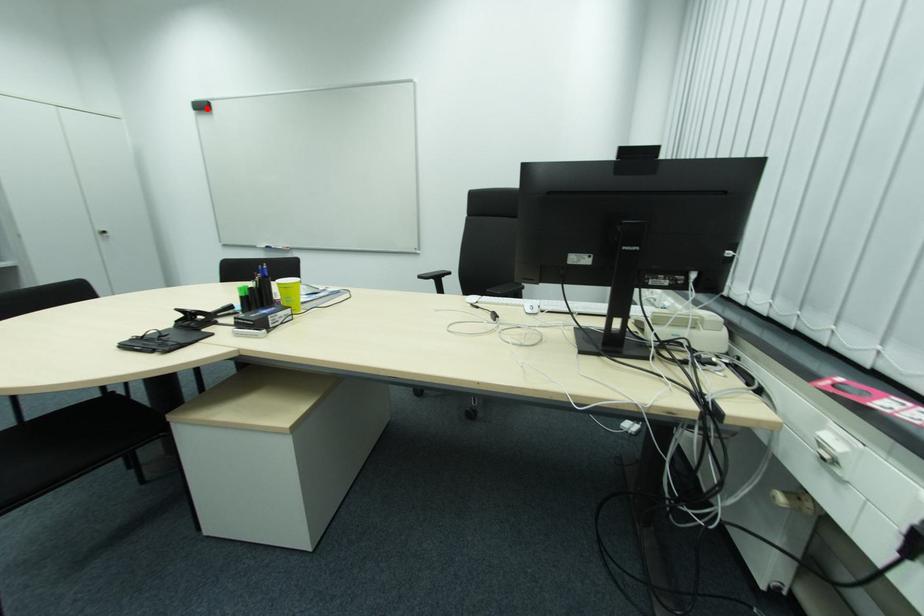
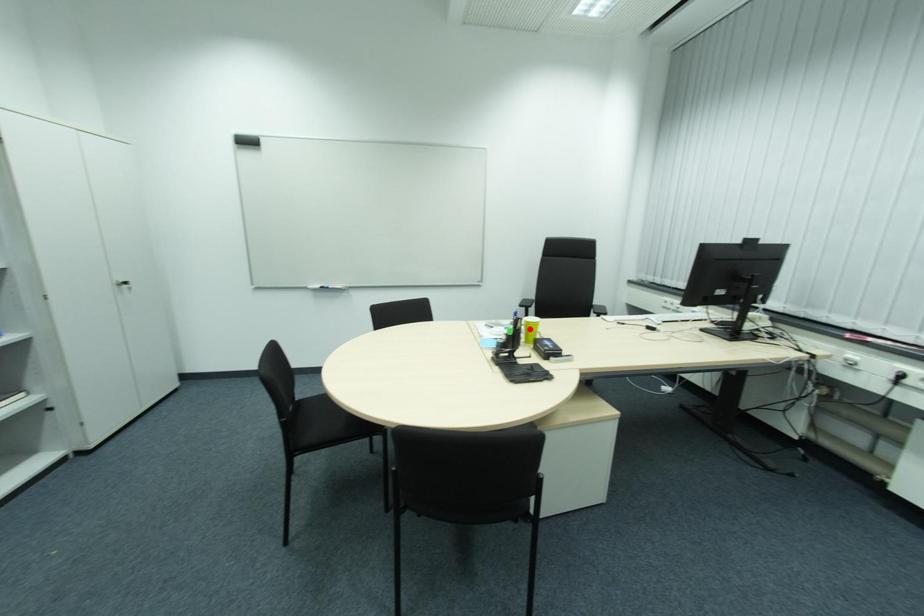
I am providing you with two images of the same scene from different viewpoints. A red point is marked on the first image and another point is marked on the second image. Does the point marked in image1 correspond to the same location as the one in image2?

No